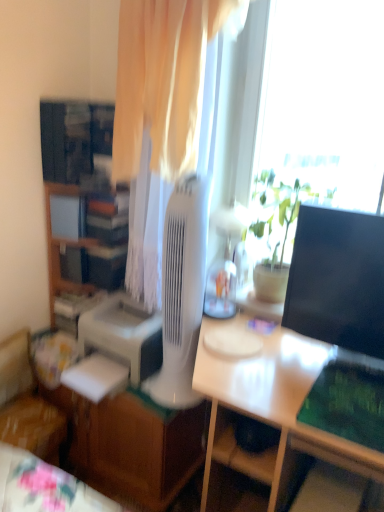
What is the approximate width of green matte plant at center?

green matte plant at center is 8.67 inches wide.

Image resolution: width=384 pixels, height=512 pixels. What do you see at coordinates (338, 279) in the screenshot? I see `black glossy monitor at right` at bounding box center [338, 279].

This screenshot has height=512, width=384. What do you see at coordinates (130, 436) in the screenshot? I see `white glossy desk at lower left, the second desk in the right-to-left sequence` at bounding box center [130, 436].

Identify the location of wooden fabric chair at lower left. (27, 403).

Considering the relative sizes of black glossy monitor at right and wooden fabric chair at lower left in the image provided, is black glossy monitor at right shorter than wooden fabric chair at lower left?

No.

Is black glossy monitor at right oriented away from wooden fabric chair at lower left?

black glossy monitor at right is not turned away from wooden fabric chair at lower left.

Is black glossy monitor at right outside of wooden fabric chair at lower left?

Yes, black glossy monitor at right is not within wooden fabric chair at lower left.

Is black glossy monitor at right wider or thinner than wooden fabric chair at lower left?

In the image, black glossy monitor at right appears to be more narrow than wooden fabric chair at lower left.

Is white glossy desk at center, which ranks as the 1th desk in right-to-left order, spatially inside black glossy monitor at right, or outside of it?

white glossy desk at center, which ranks as the 1th desk in right-to-left order, cannot be found inside black glossy monitor at right.

Could you tell me if white glossy desk at center, which ranks as the 1th desk in right-to-left order, is facing black glossy monitor at right?

No.

How many degrees apart are the facing directions of white glossy desk at center, which ranks as the 1th desk in right-to-left order, and black glossy monitor at right?

The facing directions of white glossy desk at center, which ranks as the 1th desk in right-to-left order, and black glossy monitor at right are 0.156 degrees apart.

Considering the relative positions of white glossy desk at center, which ranks as the 1th desk in right-to-left order, and black glossy monitor at right in the image provided, is white glossy desk at center, which ranks as the 1th desk in right-to-left order, to the left of black glossy monitor at right from the viewer's perspective?

Indeed, white glossy desk at center, which ranks as the 1th desk in right-to-left order, is positioned on the left side of black glossy monitor at right.

Is white glossy desk at lower left, arranged as the 1th desk when viewed from the left, oriented away from white plastic mechanical fan at center?

No, white plastic mechanical fan at center is not at the back of white glossy desk at lower left, arranged as the 1th desk when viewed from the left.

Locate an element on the screen. The height and width of the screenshot is (512, 384). desk lying on the left of white plastic mechanical fan at center is located at coordinates (130, 436).

Are white glossy desk at lower left, arranged as the 1th desk when viewed from the left, and white plastic mechanical fan at center beside each other?

white glossy desk at lower left, arranged as the 1th desk when viewed from the left, is not next to white plastic mechanical fan at center, and they're not touching.

Between white glossy desk at lower left, the second desk in the right-to-left sequence, and white plastic mechanical fan at center, which one has more height?

Standing taller between the two is white plastic mechanical fan at center.

How different are the orientations of green matte plant at center and wooden fabric chair at lower left in degrees?

There is a 92.1-degree angle between the facing directions of green matte plant at center and wooden fabric chair at lower left.

Would you consider green matte plant at center to be distant from wooden fabric chair at lower left?

Yes, green matte plant at center and wooden fabric chair at lower left are quite far apart.

Is green matte plant at center not within wooden fabric chair at lower left?

Yes.

From the image's perspective, is green matte plant at center located above or below wooden fabric chair at lower left?

Clearly, from the image's perspective, green matte plant at center is above wooden fabric chair at lower left.

Which point is more distant from viewer, (325, 223) or (144, 466)?

→ Point (144, 466)

Identify the location of the 2nd desk to the left of the black glossy monitor at right, starting your count from the anchor. Image resolution: width=384 pixels, height=512 pixels. click(130, 436).

Is black glossy monitor at right facing away from white glossy desk at lower left, the second desk in the right-to-left sequence?

No, black glossy monitor at right is not facing away from white glossy desk at lower left, the second desk in the right-to-left sequence.

Considering the sizes of objects black glossy monitor at right and white glossy desk at lower left, arranged as the 1th desk when viewed from the left, in the image provided, who is thinner, black glossy monitor at right or white glossy desk at lower left, arranged as the 1th desk when viewed from the left,?

black glossy monitor at right.

In the scene shown: Does white glossy desk at center, which ranks as the 1th desk in right-to-left order, have a larger size compared to white plastic mechanical fan at center?

Yes.

From the picture: Is white plastic mechanical fan at center completely or partially inside white glossy desk at center, which ranks as the 1th desk in right-to-left order?

No, white glossy desk at center, which ranks as the 1th desk in right-to-left order, does not contain white plastic mechanical fan at center.

From a real-world perspective, who is located lower, white glossy desk at center, which ranks as the 1th desk in right-to-left order, or white plastic mechanical fan at center?

From a 3D spatial view, white glossy desk at center, which ranks as the 1th desk in right-to-left order, is below.

Which of these two, white glossy desk at center, which ranks as the 1th desk in right-to-left order, or white plastic mechanical fan at center, stands shorter?

white plastic mechanical fan at center.

Is black glossy monitor at right smaller than wooden cabinet at left?

Yes, black glossy monitor at right is smaller than wooden cabinet at left.

Is black glossy monitor at right not close to wooden cabinet at left?

Indeed, black glossy monitor at right is not near wooden cabinet at left.

Locate an element on the screen. television positioned vertically above the wooden fabric chair at lower left (from a real-world perspective) is located at coordinates (338, 279).

What are the coordinates of `television behind the white glossy desk at center, positioned as the 2th desk in left-to-right order` in the screenshot? It's located at (338, 279).

When comparing their distances from wooden cabinet at left, does white glossy desk at center, positioned as the 2th desk in left-to-right order, or white glossy desk at lower left, arranged as the 1th desk when viewed from the left, seem closer?

white glossy desk at lower left, arranged as the 1th desk when viewed from the left, lies closer to wooden cabinet at left than the other object.

From the image, which object appears to be farther from wooden cabinet at left, white plastic mechanical fan at center or white glossy desk at center, which ranks as the 1th desk in right-to-left order?

The object further to wooden cabinet at left is white glossy desk at center, which ranks as the 1th desk in right-to-left order.

Based on their spatial positions, is white plastic mechanical fan at center or wooden cabinet at left closer to wooden fabric chair at lower left?

Based on the image, wooden cabinet at left appears to be nearer to wooden fabric chair at lower left.

From the image, which object appears to be nearer to white plastic mechanical fan at center, wooden cabinet at left or wooden fabric chair at lower left?

Based on the image, wooden cabinet at left appears to be nearer to white plastic mechanical fan at center.

From the image, which object appears to be farther from wooden fabric chair at lower left, white glossy desk at lower left, the second desk in the right-to-left sequence, or white plastic mechanical fan at center?

white plastic mechanical fan at center.

Which object lies nearer to the anchor point wooden fabric chair at lower left, white glossy desk at center, which ranks as the 1th desk in right-to-left order, or white plastic mechanical fan at center?

white plastic mechanical fan at center is closer to wooden fabric chair at lower left.

Based on their spatial positions, is black glossy monitor at right or wooden fabric chair at lower left further from green matte plant at center?

wooden fabric chair at lower left lies further to green matte plant at center than the other object.

Based on their spatial positions, is black glossy monitor at right or wooden cabinet at left further from white glossy desk at lower left, the second desk in the right-to-left sequence?

black glossy monitor at right is positioned further to the anchor white glossy desk at lower left, the second desk in the right-to-left sequence.

The width and height of the screenshot is (384, 512). I want to click on mechanical fan that lies between wooden cabinet at left and white glossy desk at lower left, the second desk in the right-to-left sequence, from top to bottom, so click(182, 293).

Image resolution: width=384 pixels, height=512 pixels. What are the coordinates of `desk situated between wooden fabric chair at lower left and white glossy desk at center, which ranks as the 1th desk in right-to-left order, from left to right` in the screenshot? It's located at (130, 436).

Find the location of `cabinetry between wooden fabric chair at lower left and black glossy monitor at right in the horizontal direction`. cabinetry between wooden fabric chair at lower left and black glossy monitor at right in the horizontal direction is located at coordinates (63, 246).

Image resolution: width=384 pixels, height=512 pixels. I want to click on mechanical fan between wooden cabinet at left and green matte plant at center in the horizontal direction, so click(182, 293).